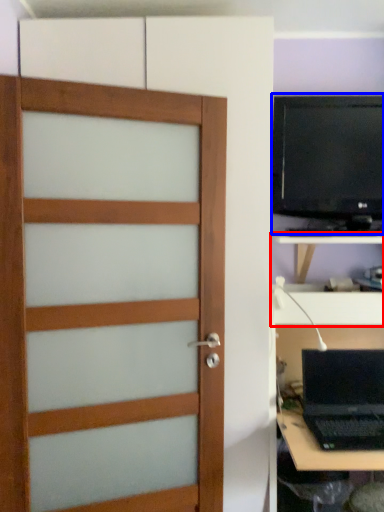
Question: Which point is further to the camera, tv cabinet (highlighted by a red box) or computer monitor (highlighted by a blue box)?

Choices:
 (A) tv cabinet
 (B) computer monitor

Answer: (B)